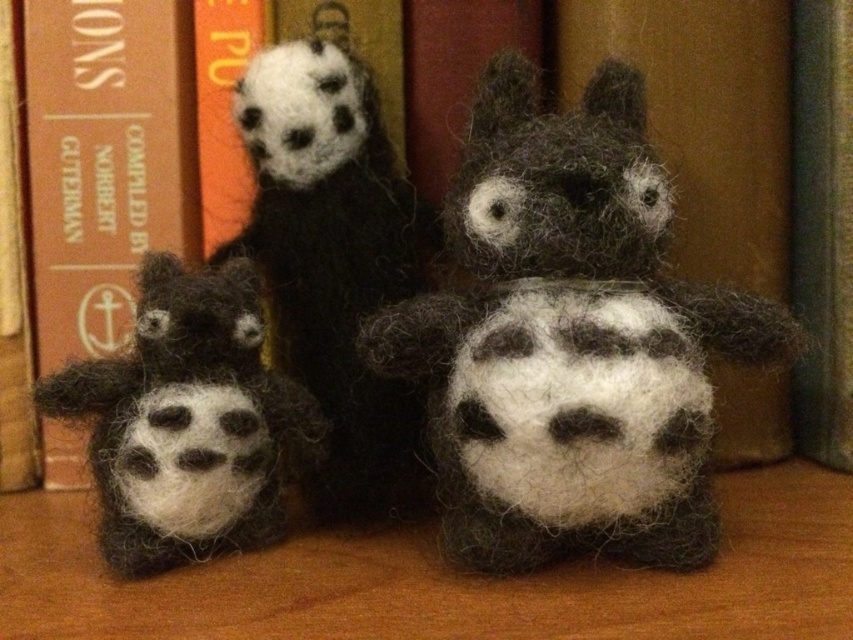
You are organizing a bookshelf and need to place the brown leather book at left and the fuzzy black and white plush at lower left. Based on their heights, which item should you place on the lower shelf to ensure stability?

The fuzzy black and white plush at lower left is shorter than the brown leather book at left, so it should be placed on the lower shelf for stability.

You are standing in front of a wooden table with two points marked on it, labeled point (38, 177) and point (103, 372). If you want to reach the point that is closer to you, which one should you choose?

Point (38, 177) is further to the viewer than point (103, 372), so the point closer to you is point (103, 372).

You are a toy collector who wants to place a new 25 cm wide decorative item between the dark gray woolen plush at center and the fuzzy black and white plush at lower left. Can you fit it there?

The distance between the dark gray woolen plush at center and the fuzzy black and white plush at lower left is 24.23 centimeters. Since the decorative item is 25 cm wide, it cannot fit in the available space.